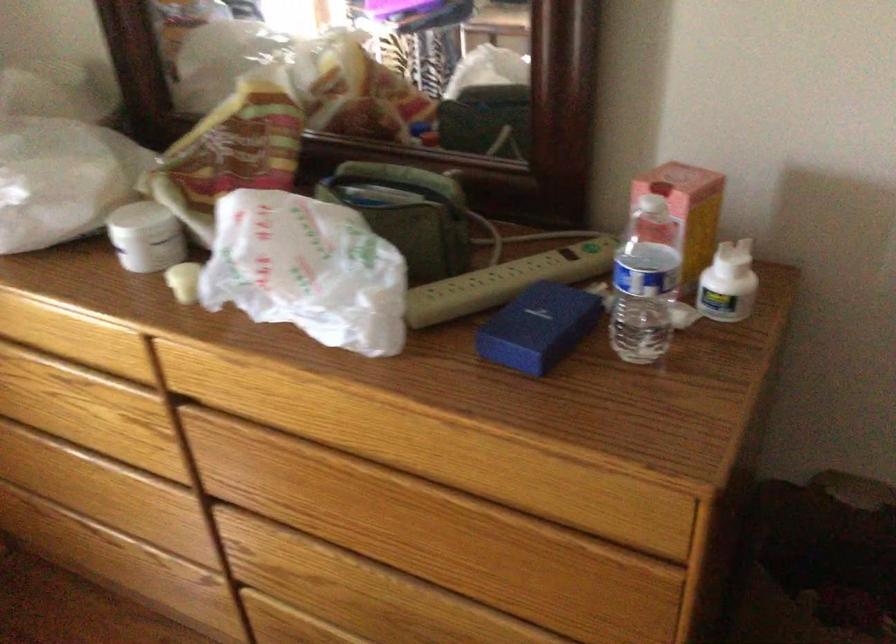
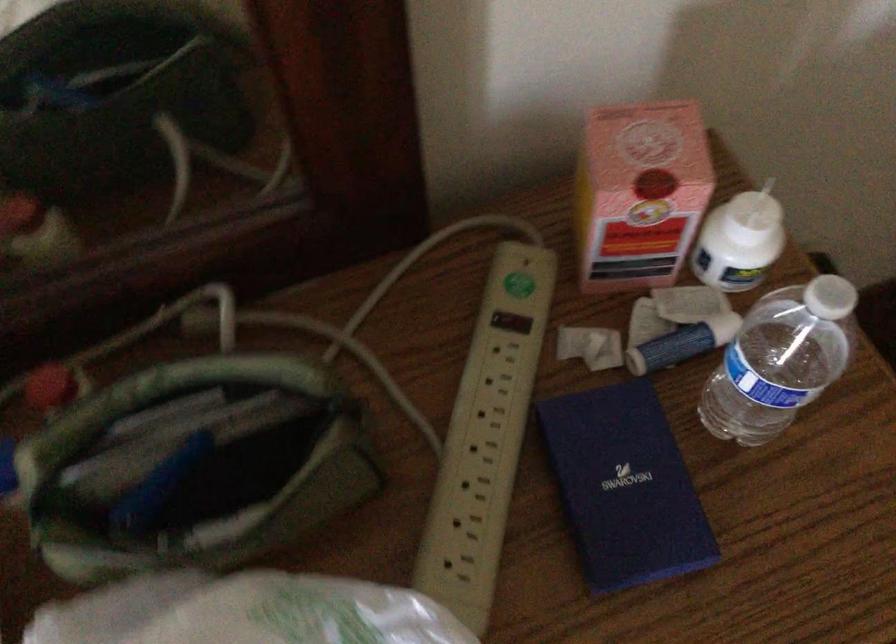
Based on the continuous images, in which direction is the camera rotating?

The rotation direction of the camera is right-down.